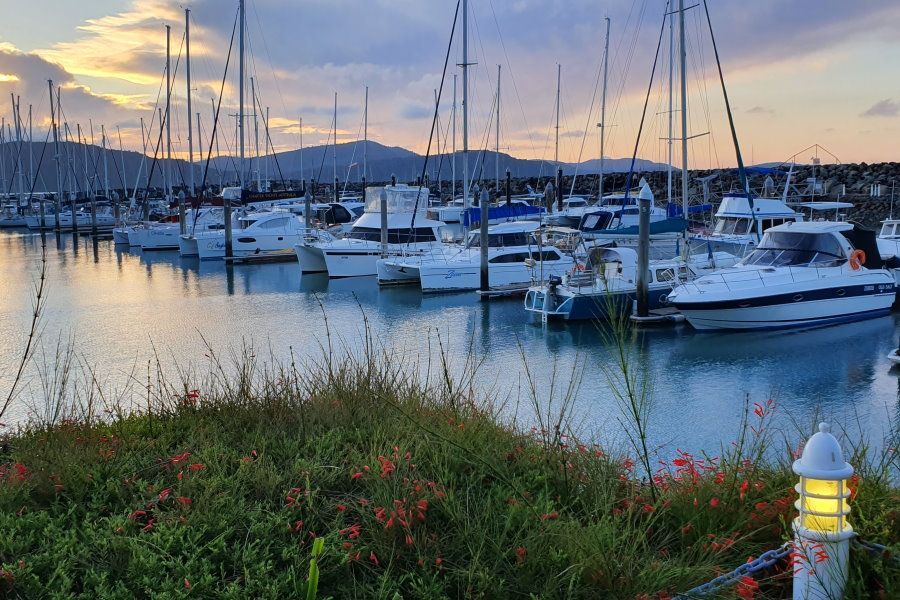
Locate an element on the screen. The height and width of the screenshot is (600, 900). light is located at coordinates (819, 502).